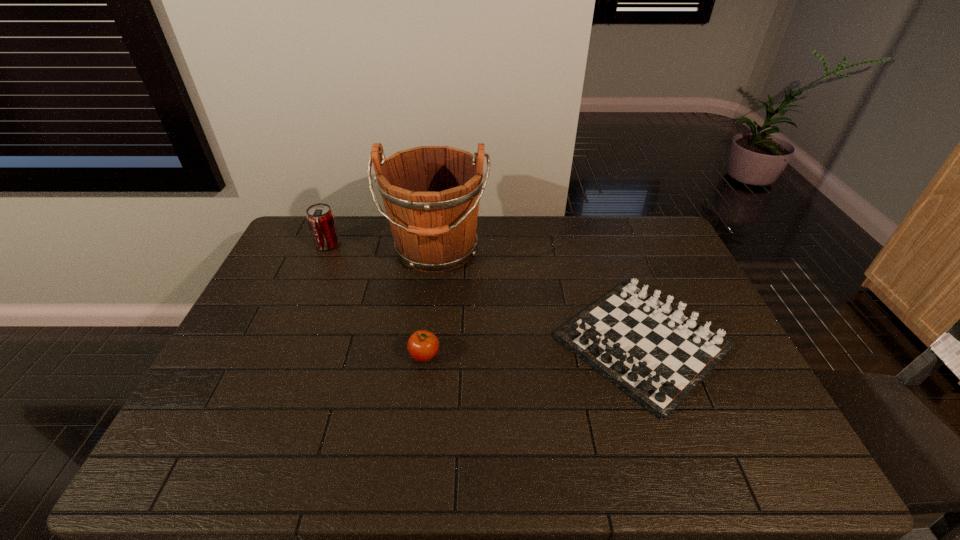
You are a GUI agent. You are given a task and a screenshot of the screen. Output one action in this format:
    pyautogui.click(x=<x>, y=<y>)
    Task: Click on the bucket that is at the far edge
    This screenshot has width=960, height=540.
    Given the screenshot: What is the action you would take?
    pyautogui.click(x=431, y=194)

Identify the location of pop soda positioned at the far edge. (320, 217).

Where is `object located at the left edge`? Image resolution: width=960 pixels, height=540 pixels. object located at the left edge is located at coordinates (320, 217).

Locate an element on the screen. object located in the right edge section of the desktop is located at coordinates (x=656, y=353).

Find the location of `object located in the far left corner section of the desktop`. object located in the far left corner section of the desktop is located at coordinates (320, 217).

Image resolution: width=960 pixels, height=540 pixels. Find the location of `vacant space at the far edge`. vacant space at the far edge is located at coordinates (586, 234).

In the image, there is a desktop. Where is `vacant space at the near edge`? This screenshot has height=540, width=960. vacant space at the near edge is located at coordinates pyautogui.click(x=646, y=453).

You are a GUI agent. You are given a task and a screenshot of the screen. Output one action in this format:
    pyautogui.click(x=<x>, y=<y>)
    Task: Click on the vacant region at the left edge of the desktop
    This screenshot has width=960, height=540.
    Given the screenshot: What is the action you would take?
    pyautogui.click(x=201, y=410)

In the image, there is a desktop. Identify the location of free space at the right edge. This screenshot has height=540, width=960. (705, 307).

In the image, there is a desktop. Where is `vacant region at the far right corner`? vacant region at the far right corner is located at coordinates (x=634, y=234).